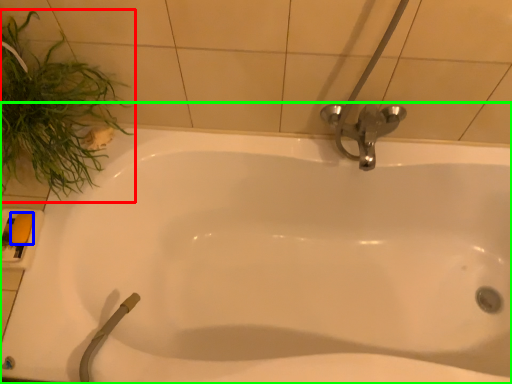
Question: Which object is positioned farthest from plant (highlighted by a red box)? Select from soap (highlighted by a blue box) and bathtub (highlighted by a green box).

Choices:
 (A) soap
 (B) bathtub

Answer: (B)